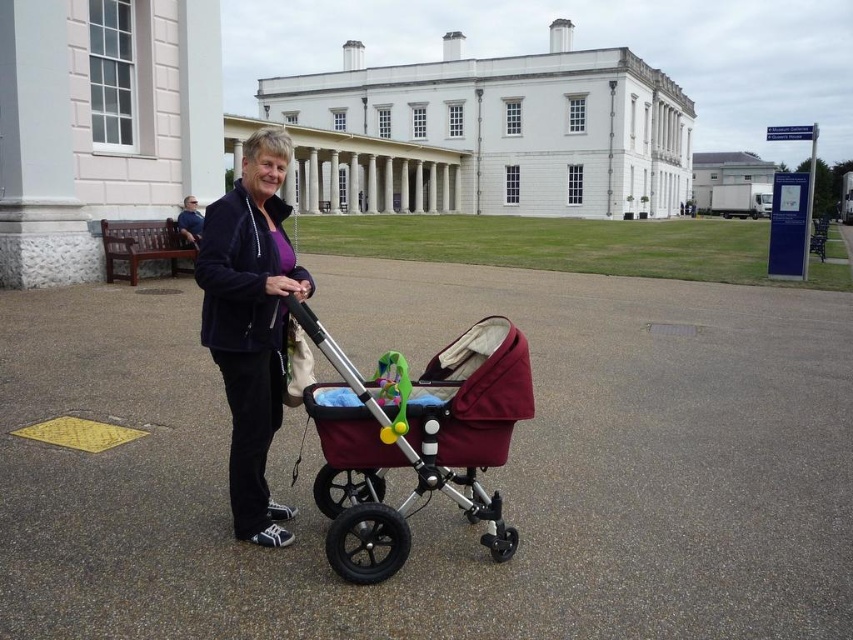
You are a photographer standing in front of the large white building. You want to take a photo of the maroon fabric baby carriage at center and the blue fabric shirt at upper center. Which object will appear wider in the photo?

The maroon fabric baby carriage at center will appear wider in the photo because its width is larger than the blue fabric shirt at upper center.